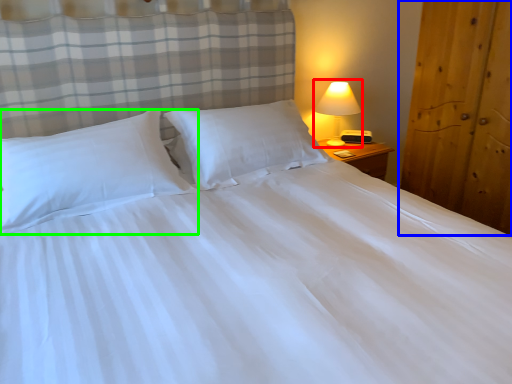
Question: Which object is positioned closest to lamp (highlighted by a red box)? Select from armoire (highlighted by a blue box) and pillow (highlighted by a green box).

Choices:
 (A) armoire
 (B) pillow

Answer: (A)